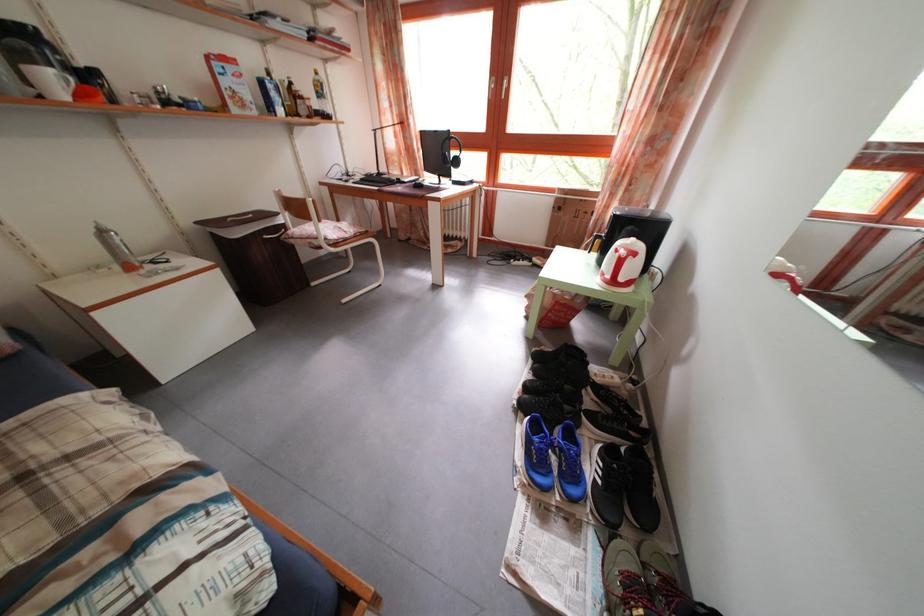
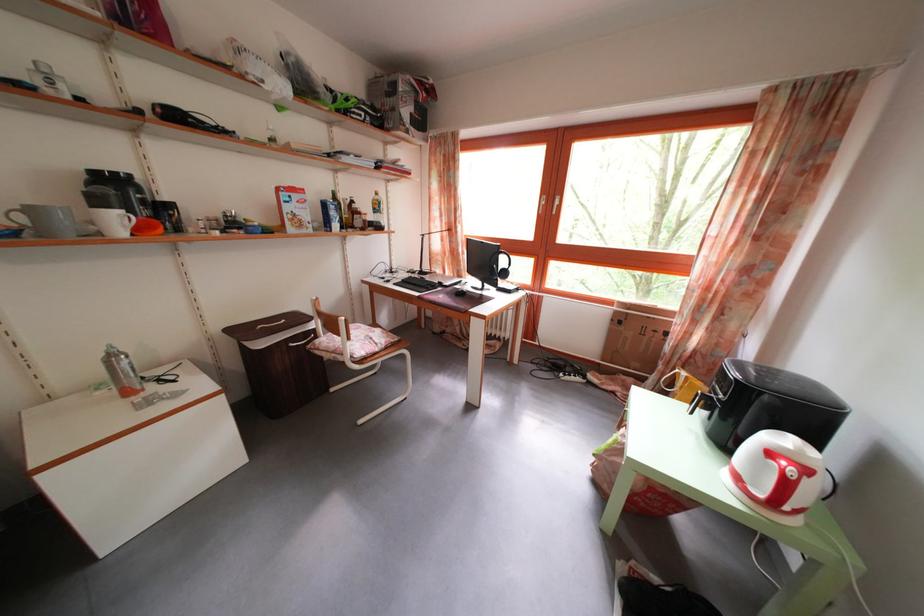
Where in the second image is the point corresponding to pixel 58 87 from the first image?

(125, 227)